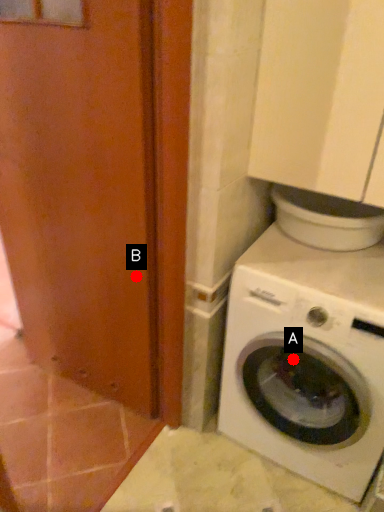
Question: Two points are circled on the image, labeled by A and B beside each circle. Which of the following is the farthest from the observer?

Choices:
 (A) A is further
 (B) B is further

Answer: (A)